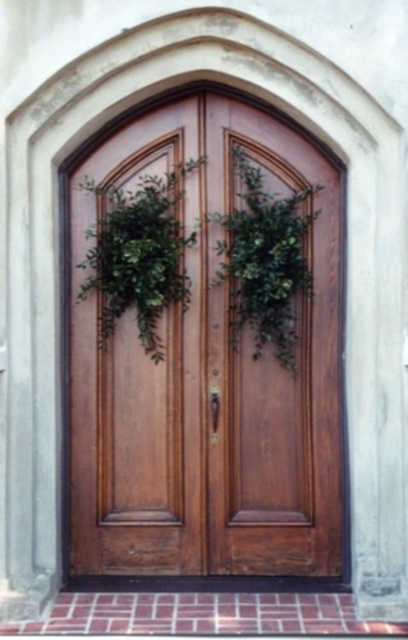
Is point (179, 369) positioned behind point (155, 209)?

Yes, point (179, 369) is farther from viewer.

I want to click on wooden door at center, so click(x=204, y=348).

Is green leafy wreath at center to the right of green leafy plant at center from the viewer's perspective?

In fact, green leafy wreath at center is to the left of green leafy plant at center.

I want to click on green leafy wreath at center, so [x=139, y=253].

Is wooden door at center wider than green leafy plant at center?

Indeed, wooden door at center has a greater width compared to green leafy plant at center.

Between wooden door at center and green leafy plant at center, which one is positioned lower?

wooden door at center is below.

Image resolution: width=408 pixels, height=640 pixels. I want to click on wooden door at center, so click(x=204, y=348).

At what (x,y) coordinates should I click in order to perform the action: click on wooden door at center. Please return your answer as a coordinate pair (x, y). Looking at the image, I should click on (204, 348).